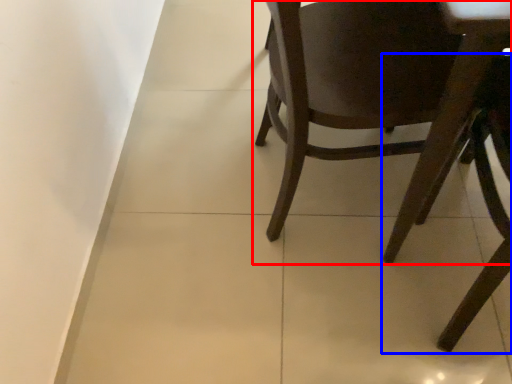
Question: Which point is further to the camera, chair (highlighted by a red box) or chair (highlighted by a blue box)?

Choices:
 (A) chair
 (B) chair

Answer: (A)